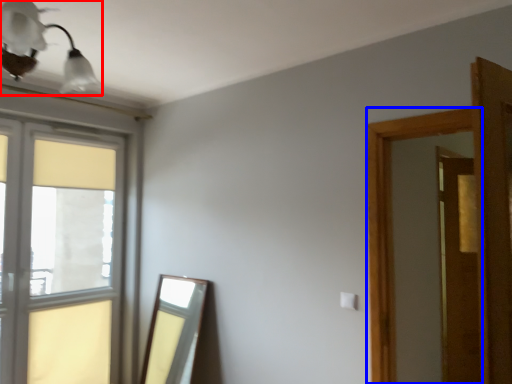
Question: Which object is closer to the camera taking this photo, light fixture (highlighted by a red box) or window frame (highlighted by a blue box)?

Choices:
 (A) light fixture
 (B) window frame

Answer: (A)